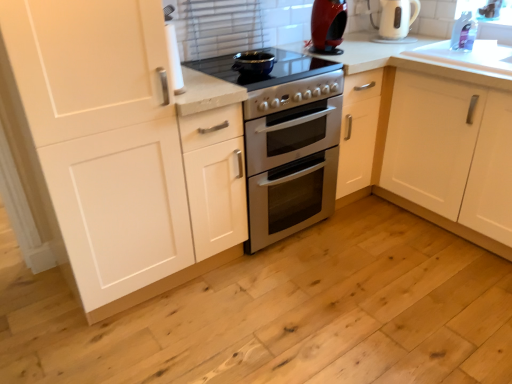
Question: Choose the correct answer: Is transparent plastic window screen at upper right inside white glossy countertop at upper right or outside it?

Choices:
 (A) outside
 (B) inside

Answer: (A)

Question: Is transparent plastic window screen at upper right in front of or behind white glossy countertop at upper right in the image?

Choices:
 (A) behind
 (B) front

Answer: (A)

Question: Considering the real-world distances, which object is closest to the white matte cabinet at left?

Choices:
 (A) shiny red coffee machine at upper center
 (B) white glossy electric kettle at upper right
 (C) matte black pot at center, marked as the 2th appliance in a bottom-to-top arrangement
 (D) transparent plastic window screen at upper right
 (E) white glossy countertop at upper right

Answer: (C)

Question: Based on their relative distances, which object is farther from the white glossy electric kettle at upper right?

Choices:
 (A) matte black pot at center, marked as the 2th appliance in a bottom-to-top arrangement
 (B) transparent plastic window screen at upper right
 (C) white matte cabinet at left
 (D) shiny red coffee machine at upper center
 (E) white glossy oven at center, marked as the 2th appliance in a top-to-bottom arrangement

Answer: (C)